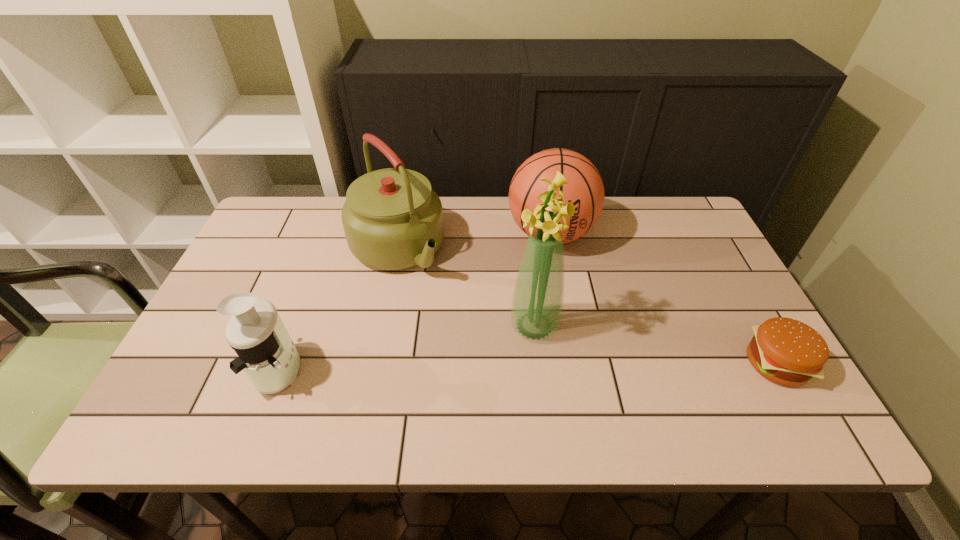
Choose which object is the nearest neighbor to the rightmost object. Please provide its 2D coordinates. Your answer should be formatted as a tuple, i.e. [(x, y)], where the tuple contains the x and y coordinates of a point satisfying the conditions above.

[(585, 189)]

Where is `free spot that satisfies the following two spatial constraints: 1. on the back side of the juicer; 2. on the left side of the basketball`? This screenshot has width=960, height=540. free spot that satisfies the following two spatial constraints: 1. on the back side of the juicer; 2. on the left side of the basketball is located at coordinates (331, 233).

You are a GUI agent. You are given a task and a screenshot of the screen. Output one action in this format:
    pyautogui.click(x=<x>, y=<y>)
    Task: Click on the free location that satisfies the following two spatial constraints: 1. on the back side of the kettle; 2. on the left side of the leftmost object
    The image size is (960, 540).
    Given the screenshot: What is the action you would take?
    pyautogui.click(x=325, y=248)

Locate an element on the screen. The image size is (960, 540). blank space that satisfies the following two spatial constraints: 1. on the back side of the leftmost object; 2. on the right side of the bouquet is located at coordinates (297, 325).